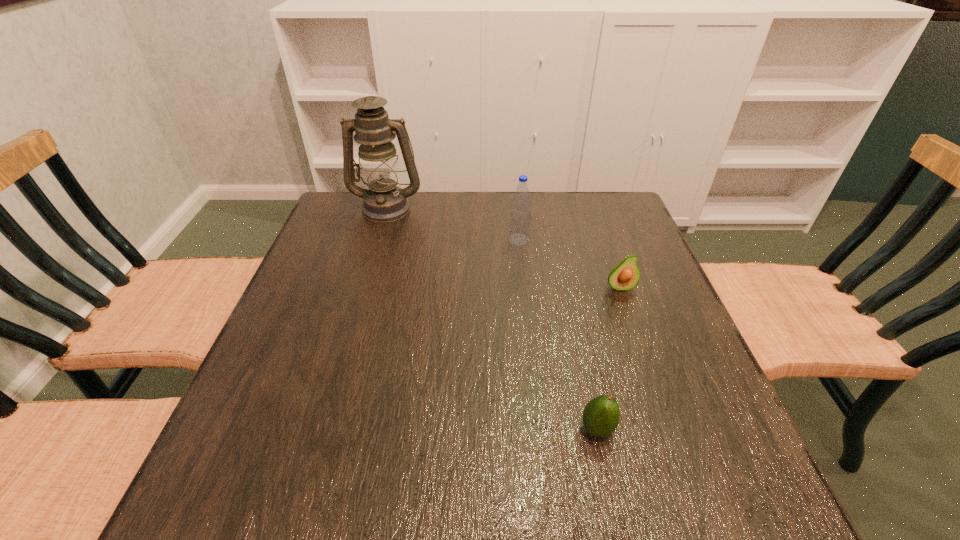
Find the location of a particular element. This screenshot has height=540, width=960. unoccupied area between the nearest object and the tallest object is located at coordinates (x=492, y=319).

Find the location of a particular element. free spot between the second nearest object and the farthest object is located at coordinates (503, 248).

Locate an element on the screen. Image resolution: width=960 pixels, height=540 pixels. vacant area that lies between the tallest object and the left avocado is located at coordinates (492, 319).

Find the location of a particular element. Image resolution: width=960 pixels, height=540 pixels. object that stands as the third closest to the third shortest object is located at coordinates (601, 415).

Locate an element on the screen. The width and height of the screenshot is (960, 540). object that can be found as the second closest to the shorter avocado is located at coordinates (520, 218).

Image resolution: width=960 pixels, height=540 pixels. Find the location of `vacant space that satisfies the following two spatial constraints: 1. on the front side of the left avocado; 2. on the right side of the farthest object`. vacant space that satisfies the following two spatial constraints: 1. on the front side of the left avocado; 2. on the right side of the farthest object is located at coordinates (322, 429).

The image size is (960, 540). Identify the location of vacant space that satisfies the following two spatial constraints: 1. on the front side of the leftmost object; 2. on the right side of the left avocado. (322, 429).